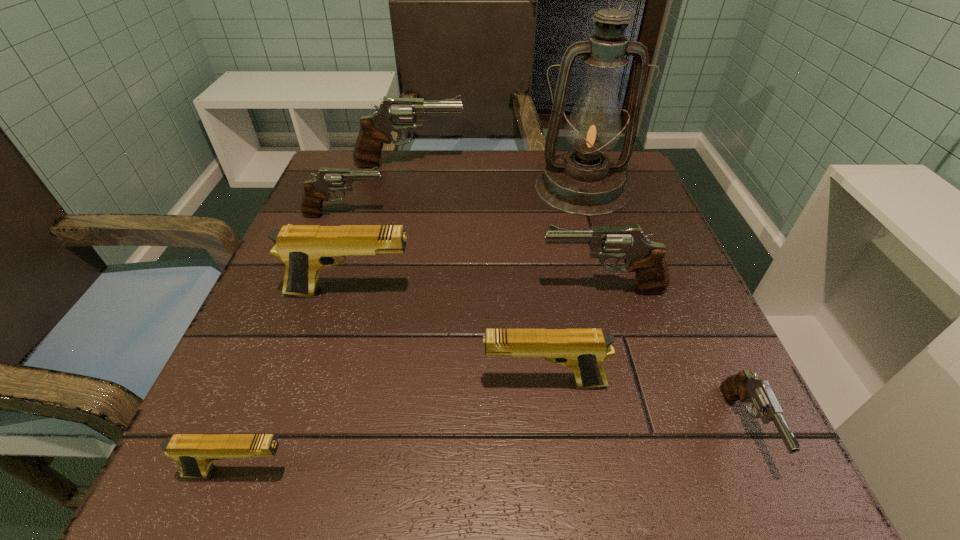
Image resolution: width=960 pixels, height=540 pixels. What are the coordinates of `oil lamp` in the screenshot? It's located at (584, 182).

This screenshot has width=960, height=540. In order to click on the farthest pistol in this screenshot , I will do `click(394, 114)`.

Where is `the farthest gray pistol`? The image size is (960, 540). the farthest gray pistol is located at coordinates (394, 114).

Find the location of a particular element. This screenshot has height=540, width=960. the third farthest gray pistol is located at coordinates (646, 258).

Find the location of a particular element. the second gray pistol from right to left is located at coordinates (646, 258).

This screenshot has height=540, width=960. Find the location of `the farthest tan pistol`. the farthest tan pistol is located at coordinates (304, 249).

This screenshot has width=960, height=540. I want to click on the second smallest gray pistol, so click(x=316, y=191).

You are a GUI agent. You are given a task and a screenshot of the screen. Output one action in this format:
    pyautogui.click(x=<x>, y=<y>)
    Task: Click on the sixth nearest pistol
    
    Given the screenshot: What is the action you would take?
    pyautogui.click(x=316, y=191)

At what (x,y) coordinates should I click in order to perform the action: click on the second biggest tan pistol. Please return your answer as a coordinate pair (x, y). Looking at the image, I should click on (583, 350).

This screenshot has height=540, width=960. I want to click on the rightmost tan pistol, so click(x=583, y=350).